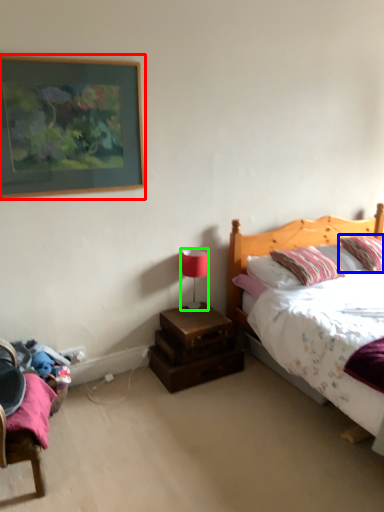
Question: Considering the real-world distances, which object is closest to picture frame (highlighted by a red box)? pillow (highlighted by a blue box) or table lamp (highlighted by a green box).

Choices:
 (A) pillow
 (B) table lamp

Answer: (B)